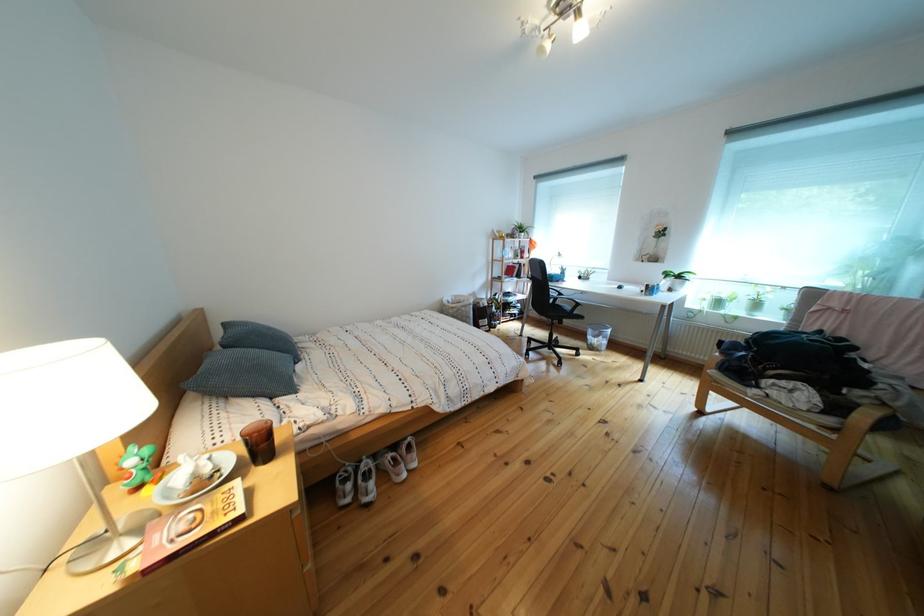
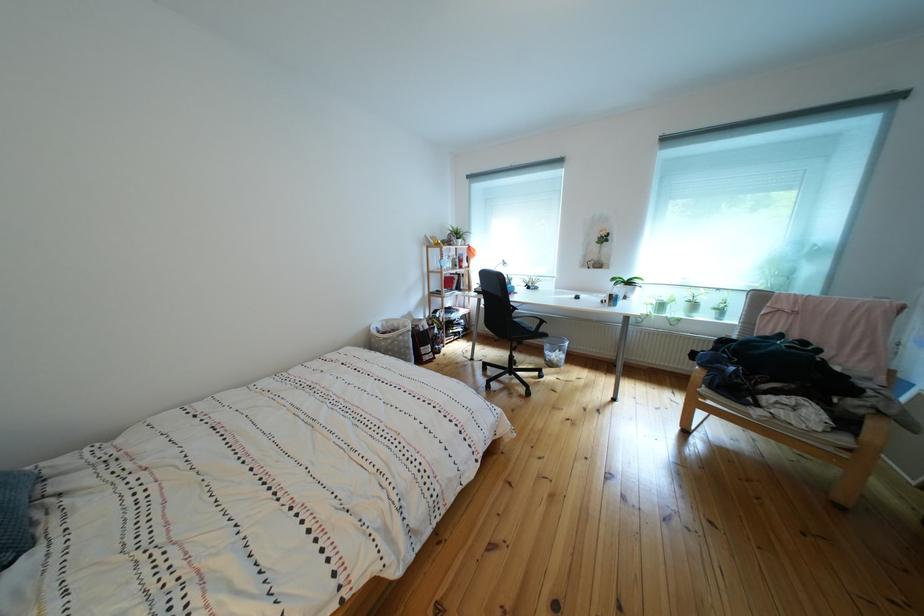
Question: What movement of the cameraman would produce the second image?

Choices:
 (A) Left
 (B) Right
 (C) Forward
 (D) Backward

Answer: (C)